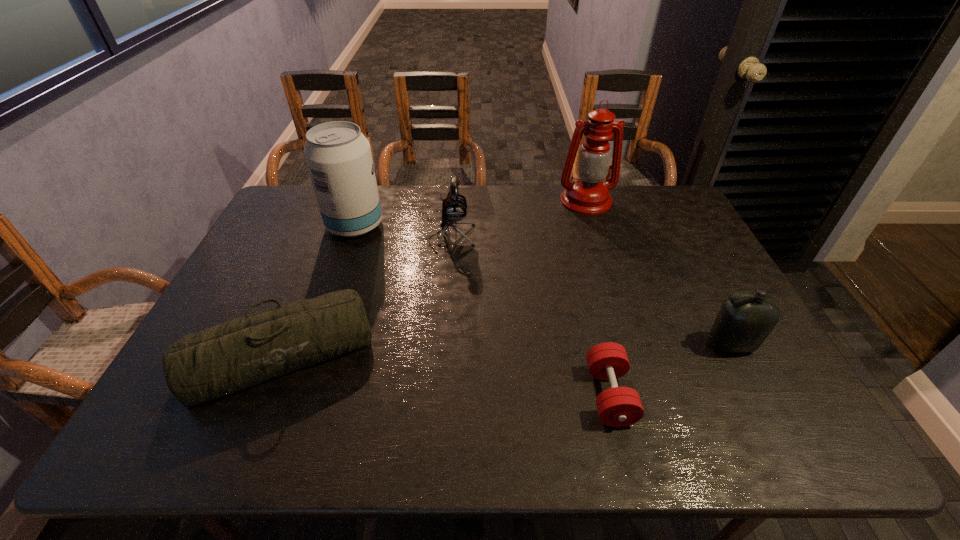
The height and width of the screenshot is (540, 960). Identify the location of vacant space that's between the alcohol and the rightmost object. (542, 285).

Image resolution: width=960 pixels, height=540 pixels. Identify the location of empty location between the shortest object and the alcohol. (482, 310).

Locate an element on the screen. The image size is (960, 540). vacant area between the shortest object and the alcohol is located at coordinates (482, 310).

Locate which object is the third closest to the duffel bag. Please provide its 2D coordinates. Your answer should be formatted as a tuple, i.e. [(x, y)], where the tuple contains the x and y coordinates of a point satisfying the conditions above.

[(618, 406)]

Choose which object is the second nearest neighbor to the alcohol. Please provide its 2D coordinates. Your answer should be formatted as a tuple, i.e. [(x, y)], where the tuple contains the x and y coordinates of a point satisfying the conditions above.

[(232, 356)]

This screenshot has height=540, width=960. I want to click on vacant space that satisfies the following two spatial constraints: 1. on the back side of the oil lamp; 2. on the left side of the third object from left to right, so click(x=455, y=200).